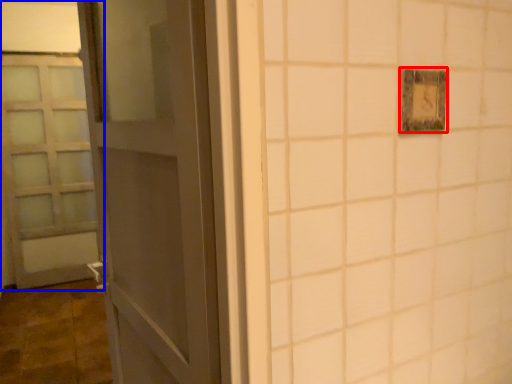
Question: Among these objects, which one is farthest to the camera, light switch (highlighted by a red box) or door (highlighted by a blue box)?

Choices:
 (A) light switch
 (B) door

Answer: (B)